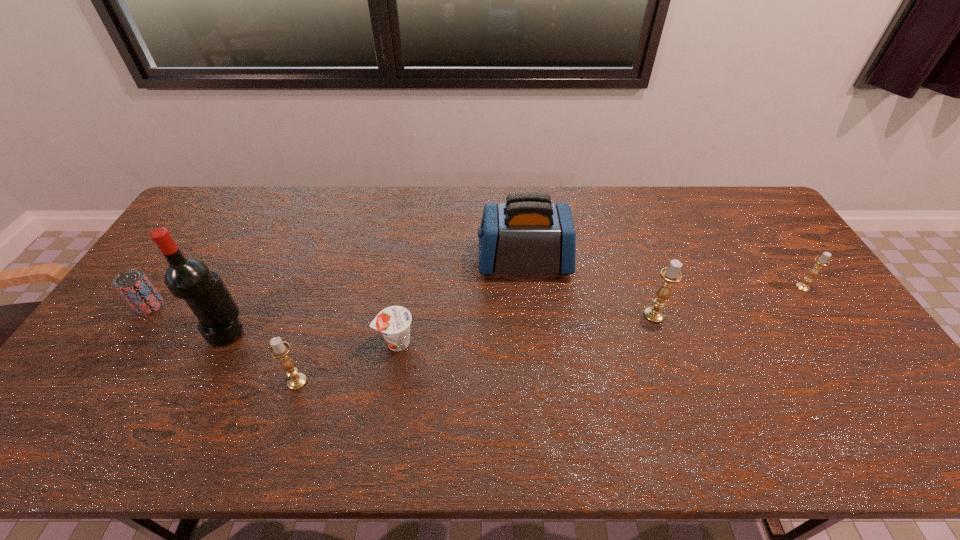
In the image, there is a desktop. Identify the location of free space at the far right corner. The width and height of the screenshot is (960, 540). (732, 228).

The image size is (960, 540). Identify the location of free space at the near right corner of the desktop. (891, 392).

Locate an element on the screen. free space between the tallest candle holder and the yogurt is located at coordinates (525, 328).

Locate an element on the screen. This screenshot has width=960, height=540. vacant space that is in between the second object from right to left and the tallest object is located at coordinates (441, 323).

You are a GUI agent. You are given a task and a screenshot of the screen. Output one action in this format:
    pyautogui.click(x=<x>, y=<y>)
    Task: Click on the free spot between the second tallest candle holder and the tallest object
    This screenshot has height=540, width=960.
    Given the screenshot: What is the action you would take?
    pyautogui.click(x=262, y=356)

At what (x,y) coordinates should I click in order to perform the action: click on vacant area that lies between the fourth object from right to left and the second candle holder from left to right. Please return your answer as a coordinate pair (x, y). The width and height of the screenshot is (960, 540). Looking at the image, I should click on [x=525, y=328].

Where is `free point between the fourth object from left to right and the fourth tallest object`? free point between the fourth object from left to right and the fourth tallest object is located at coordinates (347, 362).

At what (x,y) coordinates should I click in order to perform the action: click on free point between the nearest candle holder and the tallest candle holder. Please return your answer as a coordinate pair (x, y). This screenshot has height=540, width=960. Looking at the image, I should click on (475, 348).

You are a GUI agent. You are given a task and a screenshot of the screen. Output one action in this format:
    pyautogui.click(x=<x>, y=<y>)
    Task: Click on the object that ranks as the second closest to the second farthest candle holder
    The height and width of the screenshot is (540, 960).
    Given the screenshot: What is the action you would take?
    pyautogui.click(x=821, y=261)

I want to click on the third closest object to the yogurt, so click(x=190, y=279).